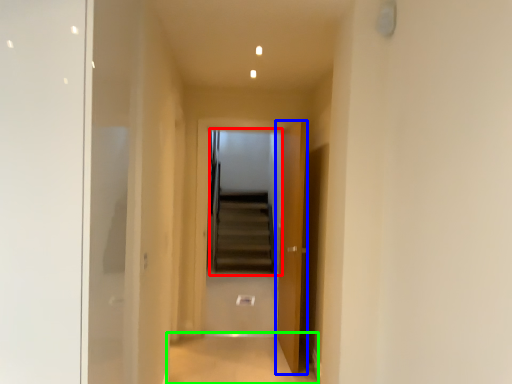
Question: Which object is positioned farthest from escalator (highlighted by a red box)? Select from door (highlighted by a blue box) and path (highlighted by a green box).

Choices:
 (A) door
 (B) path

Answer: (A)